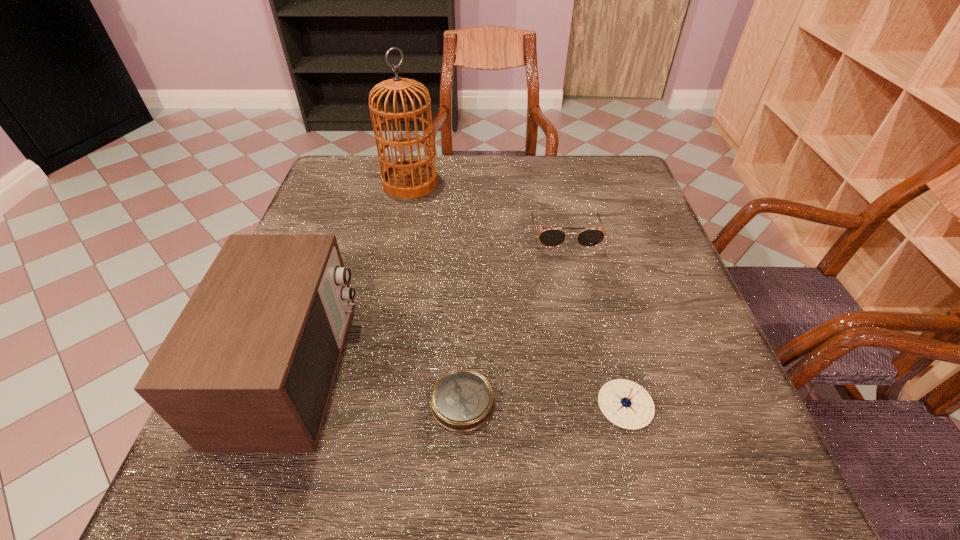
Identify the location of free space located on the front-facing side of the second tallest object. The height and width of the screenshot is (540, 960). (399, 369).

You are a GUI agent. You are given a task and a screenshot of the screen. Output one action in this format:
    pyautogui.click(x=<x>, y=<y>)
    Task: Click on the free region located 0.160m on the front lenses of the second farthest object
    The height and width of the screenshot is (540, 960).
    Given the screenshot: What is the action you would take?
    pyautogui.click(x=580, y=307)

The image size is (960, 540). What are the coordinates of `vacant space located 0.050m on the back of the taller compass` in the screenshot? It's located at (613, 357).

The width and height of the screenshot is (960, 540). I want to click on free region located 0.180m on the right of the left compass, so click(x=600, y=402).

I want to click on object at the far edge, so click(x=410, y=178).

You are a GUI agent. You are given a task and a screenshot of the screen. Output one action in this format:
    pyautogui.click(x=<x>, y=<y>)
    Task: Click on the object that is at the near edge
    Image resolution: width=960 pixels, height=540 pixels.
    Given the screenshot: What is the action you would take?
    pyautogui.click(x=249, y=366)

Where is `object present at the left edge`? The image size is (960, 540). object present at the left edge is located at coordinates (249, 366).

You are a GUI agent. You are given a task and a screenshot of the screen. Output one action in this format:
    pyautogui.click(x=<x>, y=<y>)
    Task: Click on the sunglasses that is at the right edge
    Image resolution: width=960 pixels, height=540 pixels.
    Given the screenshot: What is the action you would take?
    pyautogui.click(x=551, y=237)

Where is `compass that is at the right edge`? This screenshot has height=540, width=960. compass that is at the right edge is located at coordinates (626, 404).

Where is `object situated at the near left corner`? object situated at the near left corner is located at coordinates (249, 366).